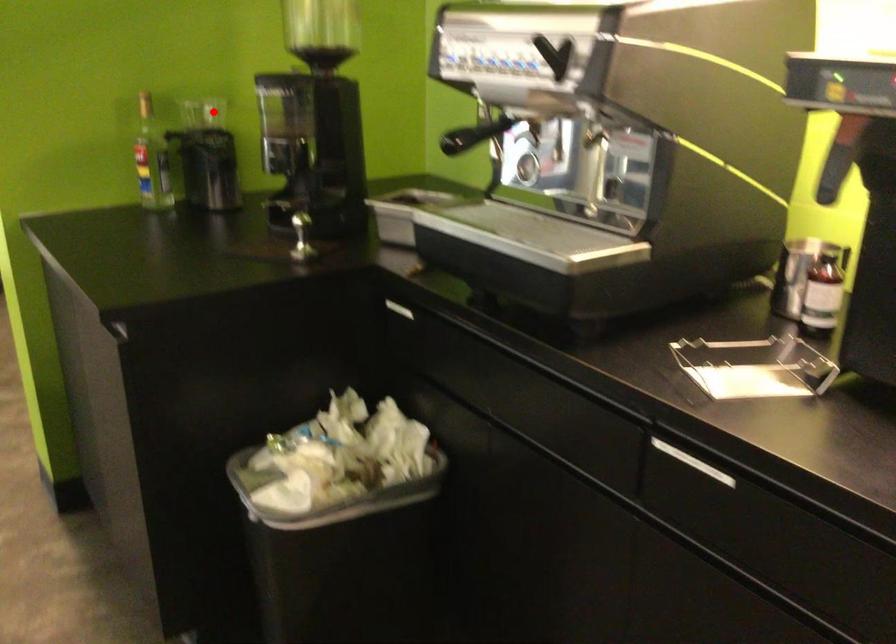
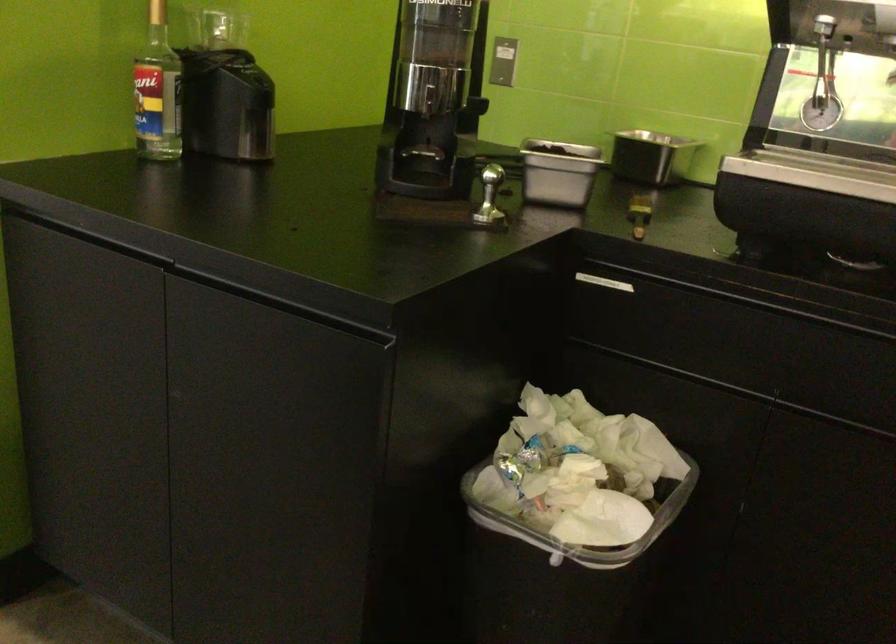
Question: I am providing you with two images of the same scene from different viewpoints. In image1, a red point is highlighted. Considering the same 3D point in image2, which of the following is correct?

Choices:
 (A) It is closer
 (B) It is farther

Answer: (A)